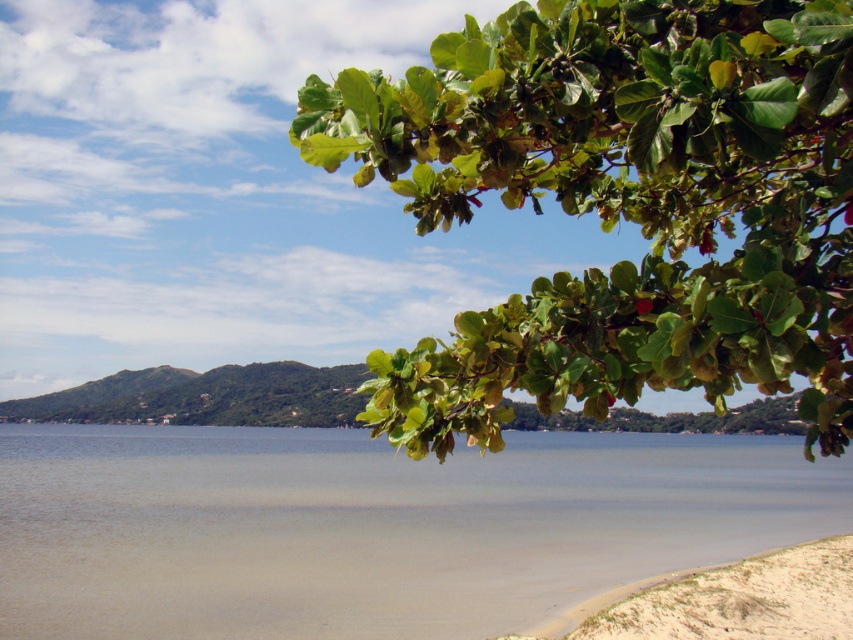
You are standing on the white sandy beach at lower right and want to pick a leaf from the green leafy branch at upper right. Can you reach it without moving from your current position?

The green leafy branch at upper right is 7.87 meters away from the white sandy beach at lower right. Since the distance is quite far, you cannot reach the branch from your current position on the white sandy beach at lower right without moving closer.

You are standing at the center of the image and want to walk towards the clear water at lower left and the white sandy beach at lower right. Which direction should you walk to reach the higher elevation first?

The clear water at lower left has a greater height compared to the white sandy beach at lower right, so you should walk towards the clear water at lower left to reach the higher elevation first.